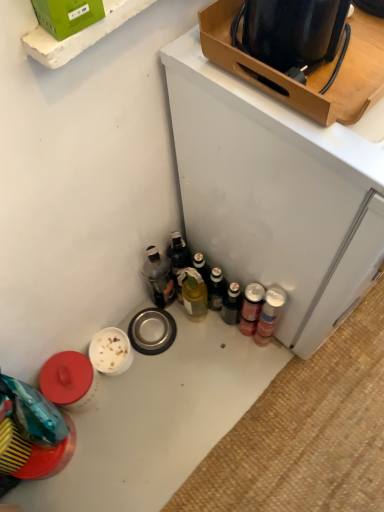
I want to click on free point above white glossy table at lower left (from a real-world perspective), so click(236, 414).